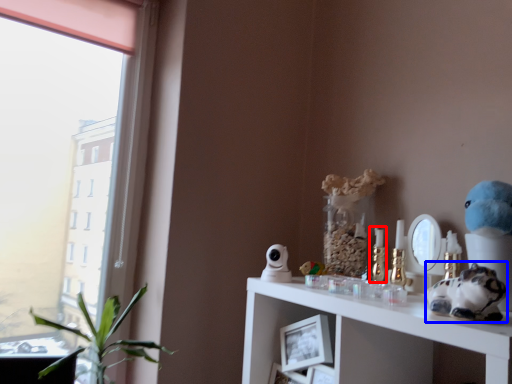
Question: Which object appears farthest to the camera in this image, candle holder (highlighted by a red box) or toy (highlighted by a blue box)?

Choices:
 (A) candle holder
 (B) toy

Answer: (A)